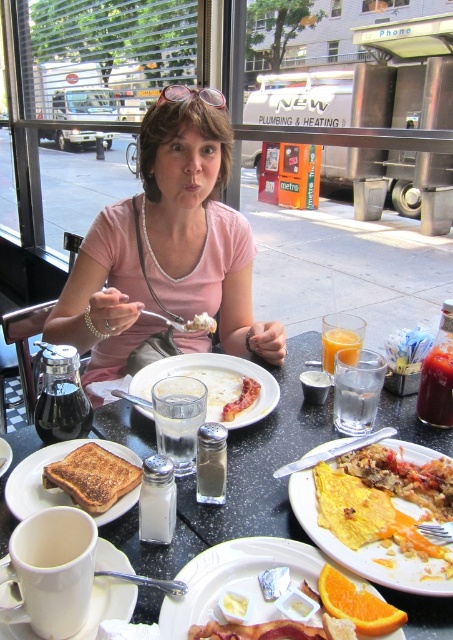
Question: Which object is closer to the camera taking this photo?

Choices:
 (A) white matte plate at center
 (B) translucent glass cup at center
 (C) yellow omelette at center
 (D) translucent glass at table center

Answer: (C)

Question: Which point is closer to the camera taking this photo?

Choices:
 (A) (417, 410)
 (B) (125, 566)
 (C) (235, 432)
 (D) (210, 324)

Answer: (B)

Question: Is black glass table at center thinner than white matte plate at center?

Choices:
 (A) yes
 (B) no

Answer: (B)

Question: Is translucent glass at table center below clear glass water at center?

Choices:
 (A) yes
 (B) no

Answer: (B)

Question: Is pink fabric shirt at center to the left of golden crispy bacon at center from the viewer's perspective?

Choices:
 (A) yes
 (B) no

Answer: (A)

Question: Estimate the real-world distances between objects in this image. Which object is farther from the clear glass water at center?

Choices:
 (A) translucent glass cup at center
 (B) toasted bread at lower left

Answer: (B)